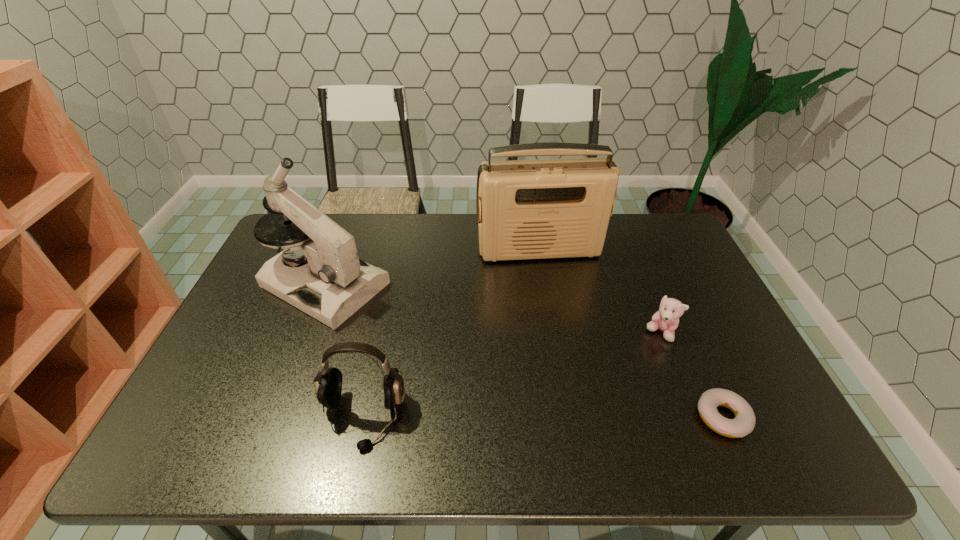
At what (x,y) coordinates should I click in order to perform the action: click on vacant space on the desktop that is between the headset and the doughnut and is positioned at the eyepiece of the microscope. Please return your answer as a coordinate pair (x, y). Looking at the image, I should click on (576, 417).

Where is `vacant space on the desktop that is between the third shortest object and the shortest object and is positioned at the face of the teddy bear`? vacant space on the desktop that is between the third shortest object and the shortest object and is positioned at the face of the teddy bear is located at coordinates (504, 417).

Identify the location of free spot on the desktop that is between the third shortest object and the shortest object and is positioned on the front-facing side of the radio receiver. (588, 417).